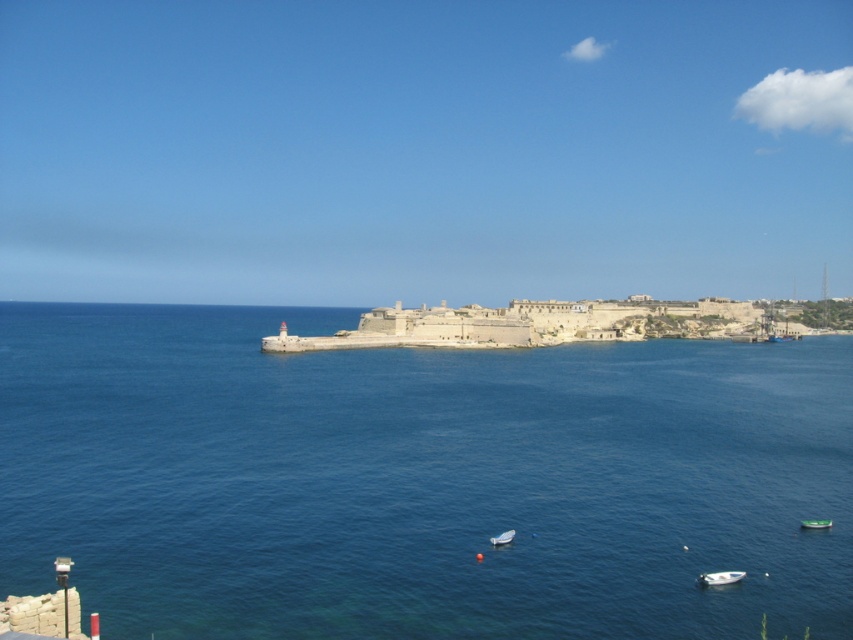
You are a sailor who wants to dock your boat at the shore near the historic fort. You see the blue water at center and the white plastic boat at lower center. Which direction should you head towards to reach the shore?

You should head towards the right side of the white plastic boat at lower center because the blue water at center is positioned on the left side of the white plastic boat at lower center, meaning the shore is to the right of the boat.

You are a sailor trying to navigate your boat to the lighthouse. You see the blue water at center and the white plastic boat at lower center. Which direction should you steer your boat to reach the lighthouse?

The blue water at center is in front of the white plastic boat at lower center, so you should steer your boat towards the blue water at center to reach the lighthouse.